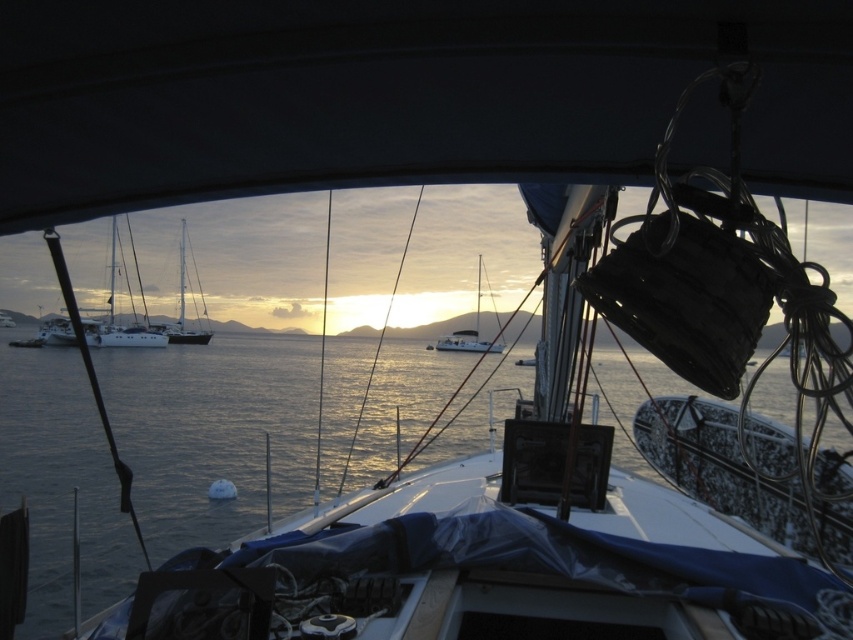
At what (x,y) coordinates should I click in order to perform the action: click on white glossy sailboat at center. Please return your answer as a coordinate pair (x, y). The height and width of the screenshot is (640, 853). Looking at the image, I should click on (184, 307).

Is point (181, 280) positioned after point (47, 333)?

Yes, point (181, 280) is behind point (47, 333).

Where is `white glossy sailboat at center`? white glossy sailboat at center is located at coordinates (184, 307).

Which is in front, point (425, 596) or point (154, 333)?

Point (425, 596)

Which of these two, glistening silver water at center or white matte sailboat at left, stands taller?

white matte sailboat at left

Does point (335, 513) come behind point (117, 330)?

No, (335, 513) is in front of (117, 330).

This screenshot has width=853, height=640. I want to click on glistening silver water at center, so click(x=430, y=608).

In the scene shown: Can you confirm if white matte sailboat at left is taller than white glossy sailboat at center?

No.

Is point (107, 339) behind point (178, 262)?

That is False.

Identify the location of white matte sailboat at left. (x=113, y=312).